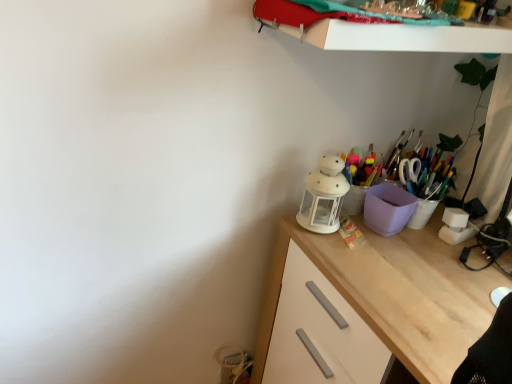
Question: From a real-world perspective, relative to white glossy shelf at upper center, is light wood desk at lower right vertically above or below?

Choices:
 (A) below
 (B) above

Answer: (A)

Question: Is light wood desk at lower right in front of or behind white glossy shelf at upper center in the image?

Choices:
 (A) front
 (B) behind

Answer: (B)

Question: Does point (286, 251) appear closer or farther from the camera than point (380, 24)?

Choices:
 (A) closer
 (B) farther

Answer: (B)

Question: Is white glossy shelf at upper center bigger or smaller than light wood desk at lower right?

Choices:
 (A) big
 (B) small

Answer: (B)

Question: Is white glossy shelf at upper center situated inside light wood desk at lower right or outside?

Choices:
 (A) inside
 (B) outside

Answer: (B)

Question: From a real-world perspective, relative to light wood desk at lower right, is white glossy shelf at upper center vertically above or below?

Choices:
 (A) above
 (B) below

Answer: (A)

Question: Considering their positions, is white glossy shelf at upper center located in front of or behind light wood desk at lower right?

Choices:
 (A) front
 (B) behind

Answer: (A)